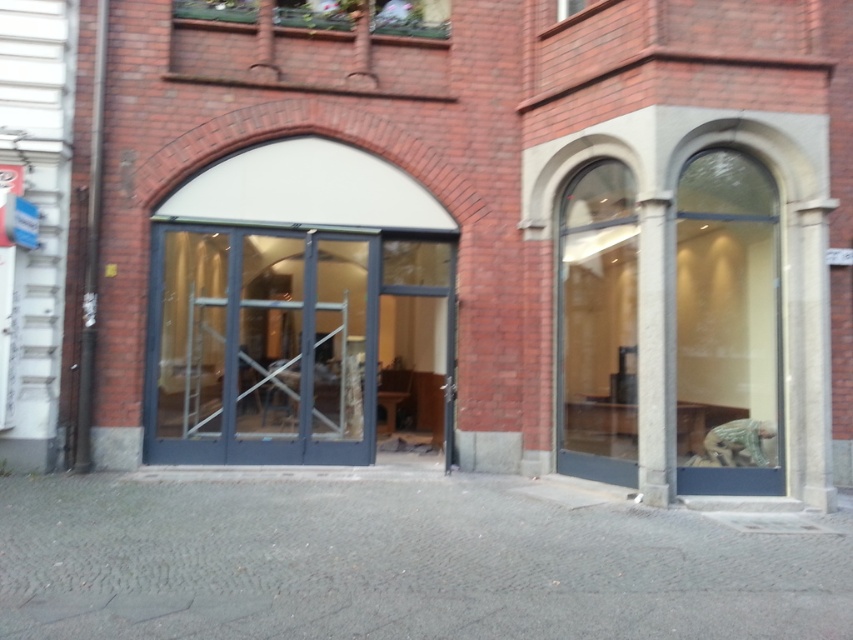
Is transparent glass door at center wider than gray stone column at right?

Indeed, transparent glass door at center has a greater width compared to gray stone column at right.

Who is shorter, transparent glass door at center or gray stone column at right?

transparent glass door at center is shorter.

Which is in front, point (344, 400) or point (651, 380)?

Point (651, 380) is more forward.

I want to click on transparent glass door at center, so click(262, 348).